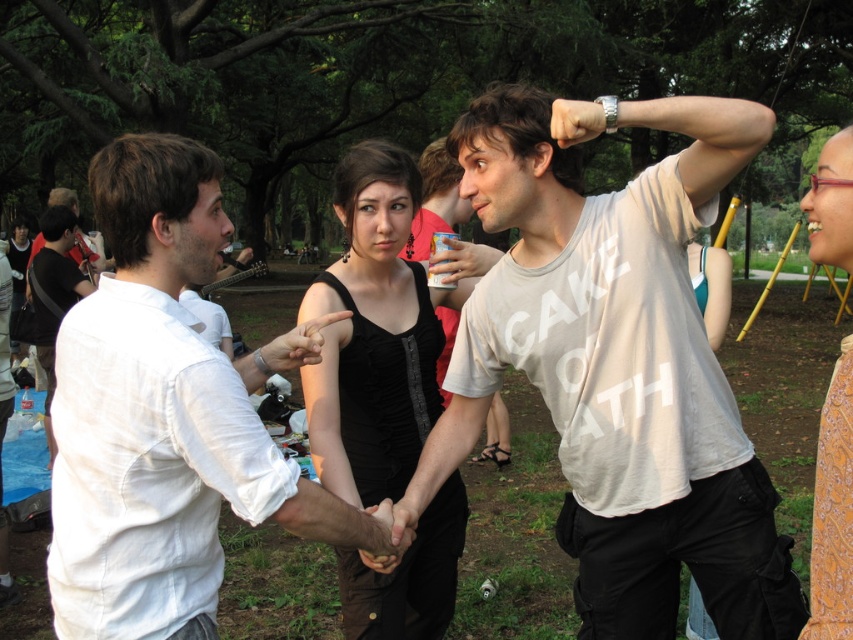
Is point (689, 353) positioned behind point (467, 205)?

No.

Between point (715, 202) and point (427, 161), which one is positioned in front?

Point (715, 202) is more forward.

Locate an element on the screen. This screenshot has width=853, height=640. light beige cotton t-shirt at center is located at coordinates (618, 362).

Describe the element at coordinates (372, 336) in the screenshot. The height and width of the screenshot is (640, 853). I see `black matte dress at center` at that location.

Who is more forward, (357,147) or (456,312)?

Positioned in front is point (357,147).

Between point (349, 289) and point (444, 310), which one is positioned in front?

Point (349, 289) is in front.

This screenshot has height=640, width=853. Identify the location of black matte dress at center. (372, 336).

Is white cotton shirt at center taller than black matte dress at center?

No.

Is white cotton shirt at center closer to camera compared to black matte dress at center?

Yes, it is.

Locate an element on the screen. The height and width of the screenshot is (640, 853). white cotton shirt at center is located at coordinates pyautogui.click(x=166, y=417).